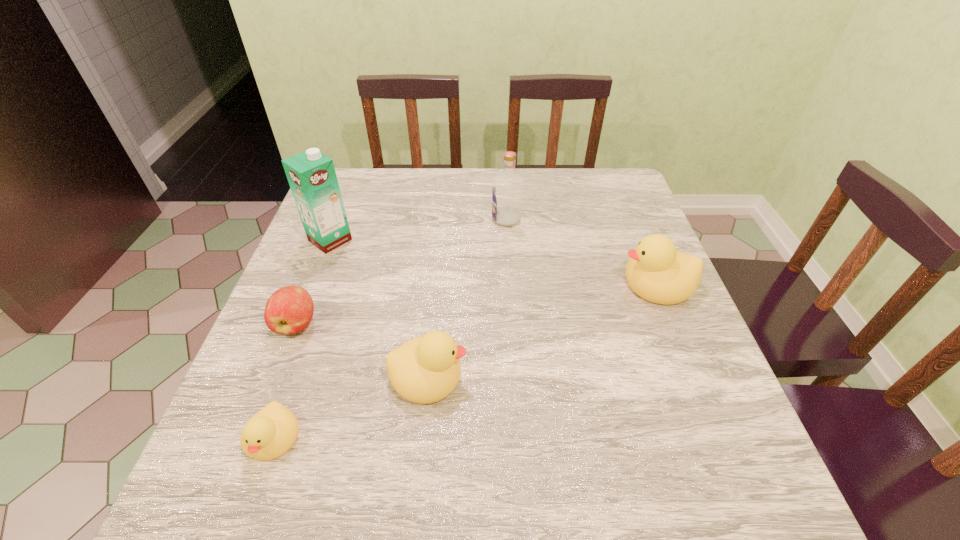
If we want them evenly spaced by inserting an extra duckling among them, please locate a free spot for this new duckling. Please provide its 2D coordinates. Your answer should be formatted as a tuple, i.e. [(x, y)], where the tuple contains the x and y coordinates of a point satisfying the conditions above.

[(554, 324)]